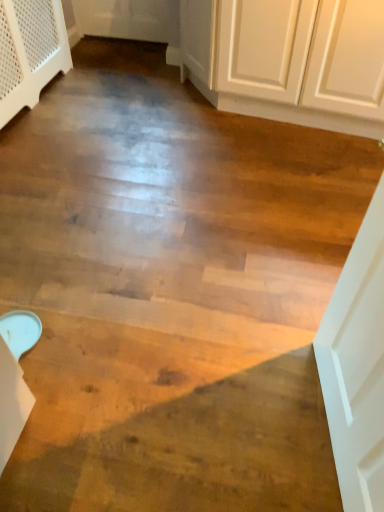
Where is `white textured dresser at upper left`? The height and width of the screenshot is (512, 384). white textured dresser at upper left is located at coordinates (30, 52).

Measure the distance between white textured dresser at upper left and camera.

A distance of 2.27 meters exists between white textured dresser at upper left and camera.

The height and width of the screenshot is (512, 384). What do you see at coordinates (30, 52) in the screenshot?
I see `white textured dresser at upper left` at bounding box center [30, 52].

What is the approximate width of white textured dresser at upper left?

white textured dresser at upper left is 17.89 centimeters wide.

This screenshot has width=384, height=512. What do you see at coordinates (357, 365) in the screenshot?
I see `white matte door at right` at bounding box center [357, 365].

Image resolution: width=384 pixels, height=512 pixels. Identify the location of white matte door at right. (357, 365).

You are a GUI agent. You are given a task and a screenshot of the screen. Output one action in this format:
    pyautogui.click(x=<x>, y=<y>)
    Task: Click on the white textured dresser at upper left
    The image size is (384, 512).
    Given the screenshot: What is the action you would take?
    pyautogui.click(x=30, y=52)

Can you confirm if white textured dresser at upper left is positioned to the right of white matte door at right?

No.

Is white textured dresser at upper left behind white matte door at right?

Yes, it is.

Is point (51, 14) positioned after point (354, 379)?

Yes, it is.

From the image's perspective, between white textured dresser at upper left and white matte door at right, who is located below?

white matte door at right.

From a real-world perspective, which is physically below, white textured dresser at upper left or white matte door at right?

white textured dresser at upper left.

Which of these two, white textured dresser at upper left or white matte door at right, is thinner?

Thinner between the two is white matte door at right.

Considering the sizes of white textured dresser at upper left and white matte door at right in the image, is white textured dresser at upper left taller or shorter than white matte door at right?

Clearly, white textured dresser at upper left is shorter compared to white matte door at right.

Which of these two, white textured dresser at upper left or white matte door at right, is smaller?

Smaller between the two is white matte door at right.

Based on the photo, is white textured dresser at upper left outside of white matte door at right?

Yes.

Is white textured dresser at upper left touching white matte door at right?

white textured dresser at upper left and white matte door at right are not in contact.

Could you tell me if white textured dresser at upper left is facing white matte door at right?

No, white textured dresser at upper left does not turn towards white matte door at right.

Measure the distance from white textured dresser at upper left to white matte door at right.

white textured dresser at upper left is 2.28 meters away from white matte door at right.

I want to click on dresser above the white matte door at right (from the image's perspective), so click(x=30, y=52).

Visually, is white matte door at right positioned to the left or to the right of white textured dresser at upper left?

Based on their positions, white matte door at right is located to the right of white textured dresser at upper left.

Considering their positions, is white matte door at right located in front of or behind white textured dresser at upper left?

Visually, white matte door at right is located in front of white textured dresser at upper left.

Is point (358, 455) more distant than point (44, 10)?

No, (358, 455) is in front of (44, 10).

From the image's perspective, between white matte door at right and white textured dresser at upper left, who is located below?

From the image's view, white matte door at right is below.

From a real-world perspective, is white matte door at right above or below white textured dresser at upper left?

white matte door at right is above white textured dresser at upper left.

In terms of width, does white matte door at right look wider or thinner when compared to white textured dresser at upper left?

In the image, white matte door at right appears to be more narrow than white textured dresser at upper left.

Does white matte door at right have a lesser height compared to white textured dresser at upper left?

No, white matte door at right is not shorter than white textured dresser at upper left.

Is white matte door at right smaller than white textured dresser at upper left?

Indeed, white matte door at right has a smaller size compared to white textured dresser at upper left.

Is white matte door at right completely or partially outside of white textured dresser at upper left?

Yes, white matte door at right is outside of white textured dresser at upper left.

Would you say white matte door at right is a long distance from white textured dresser at upper left?

white matte door at right is positioned a significant distance from white textured dresser at upper left.

Is white matte door at right turned away from white textured dresser at upper left?

white matte door at right is not turned away from white textured dresser at upper left.

Can you tell me how much white matte door at right and white textured dresser at upper left differ in facing direction?

The angle between the facing direction of white matte door at right and the facing direction of white textured dresser at upper left is 170 degrees.

Measure the distance between white matte door at right and white textured dresser at upper left.

They are 2.28 meters apart.

Locate an element on the screen. This screenshot has height=512, width=384. door in front of the white textured dresser at upper left is located at coordinates (357, 365).

At what (x,y) coordinates should I click in order to perform the action: click on door in front of the white textured dresser at upper left. Please return your answer as a coordinate pair (x, y). Looking at the image, I should click on (357, 365).

What are the coordinates of `door above the white textured dresser at upper left (from a real-world perspective)` in the screenshot? It's located at (357, 365).